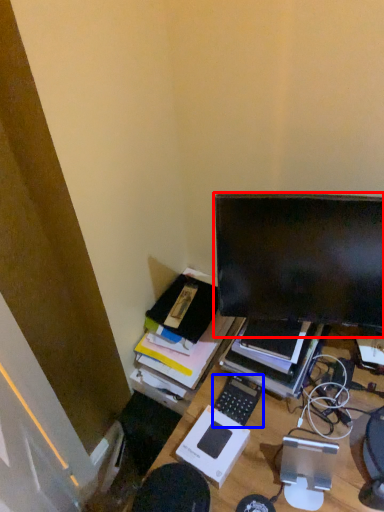
Question: Among these objects, which one is nearest to the camera, computer monitor (highlighted by a red box) or computer keyboard (highlighted by a blue box)?

Choices:
 (A) computer monitor
 (B) computer keyboard

Answer: (A)